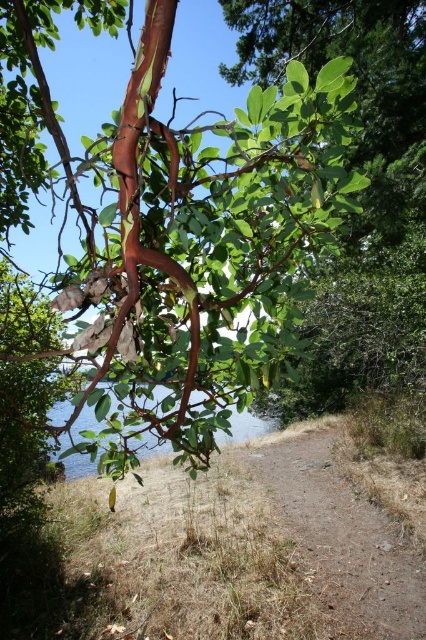
Question: Can you confirm if smooth reddish-brown branch at upper center is positioned below clear water at lower center?

Choices:
 (A) yes
 (B) no

Answer: (B)

Question: Which of the following is the closest to the observer?

Choices:
 (A) dried grass at center
 (B) smooth reddish-brown branch at upper center
 (C) clear water at lower center

Answer: (B)

Question: Which of the following is the farthest from the observer?

Choices:
 (A) clear water at lower center
 (B) smooth reddish-brown branch at upper center

Answer: (A)

Question: Is smooth reddish-brown branch at upper center above dried grass at center?

Choices:
 (A) no
 (B) yes

Answer: (B)

Question: Is smooth reddish-brown branch at upper center above dried grass at center?

Choices:
 (A) no
 (B) yes

Answer: (B)

Question: Among these objects, which one is farthest from the camera?

Choices:
 (A) dried grass at center
 (B) smooth reddish-brown branch at upper center

Answer: (A)